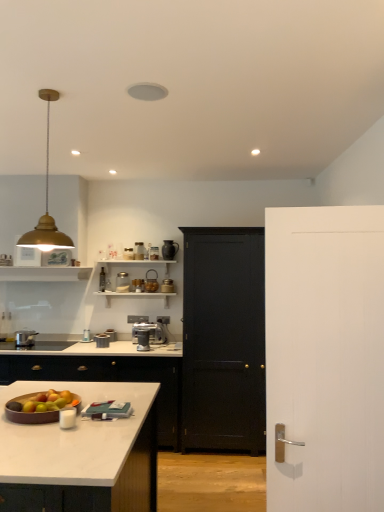
Question: Should I look upward or downward to see metallic silver canister at center, acting as the 7th appliance starting from the right?

Choices:
 (A) down
 (B) up

Answer: (A)

Question: Is satin silver coffee machine at center next to metallic silver toaster at center, arranged as the 3th appliance when viewed from the left, and touching it?

Choices:
 (A) yes
 (B) no

Answer: (B)

Question: Can metallic silver toaster at center, which appears as the 6th appliance when viewed from the right, be found inside satin silver coffee machine at center?

Choices:
 (A) yes
 (B) no

Answer: (B)

Question: Is satin silver coffee machine at center positioned before metallic silver toaster at center, arranged as the 3th appliance when viewed from the left?

Choices:
 (A) yes
 (B) no

Answer: (A)

Question: Can you confirm if satin silver coffee machine at center is shorter than metallic silver toaster at center, arranged as the 3th appliance when viewed from the left?

Choices:
 (A) yes
 (B) no

Answer: (B)

Question: Is satin silver coffee machine at center positioned with its back to metallic silver toaster at center, which appears as the 6th appliance when viewed from the right?

Choices:
 (A) yes
 (B) no

Answer: (B)

Question: Can you confirm if satin silver coffee machine at center is bigger than metallic silver toaster at center, arranged as the 3th appliance when viewed from the left?

Choices:
 (A) yes
 (B) no

Answer: (A)

Question: Does metallic silver toaster at upper center, arranged as the first appliance when viewed from the left, turn towards metallic silver canister at center, which is the 2th appliance in left-to-right order?

Choices:
 (A) yes
 (B) no

Answer: (B)

Question: Is metallic silver toaster at upper center, arranged as the first appliance when viewed from the left, to the right of metallic silver canister at center, which is the 2th appliance in left-to-right order, from the viewer's perspective?

Choices:
 (A) yes
 (B) no

Answer: (B)

Question: From a real-world perspective, is metallic silver toaster at upper center, positioned as the 8th appliance in right-to-left order, on metallic silver canister at center, which is the 2th appliance in left-to-right order?

Choices:
 (A) no
 (B) yes

Answer: (B)

Question: Is metallic silver toaster at upper center, positioned as the 8th appliance in right-to-left order, closer to camera compared to metallic silver canister at center, acting as the 7th appliance starting from the right?

Choices:
 (A) no
 (B) yes

Answer: (A)

Question: Considering the relative sizes of metallic silver toaster at upper center, positioned as the 8th appliance in right-to-left order, and metallic silver canister at center, acting as the 7th appliance starting from the right, in the image provided, is metallic silver toaster at upper center, positioned as the 8th appliance in right-to-left order, shorter than metallic silver canister at center, acting as the 7th appliance starting from the right,?

Choices:
 (A) yes
 (B) no

Answer: (B)

Question: Are metallic silver toaster at upper center, arranged as the first appliance when viewed from the left, and metallic silver canister at center, which is the 2th appliance in left-to-right order, far apart?

Choices:
 (A) no
 (B) yes

Answer: (A)

Question: Can you confirm if gold metallic pendant light at upper left is wider than metallic silver toaster at upper center, arranged as the first appliance when viewed from the left?

Choices:
 (A) yes
 (B) no

Answer: (A)